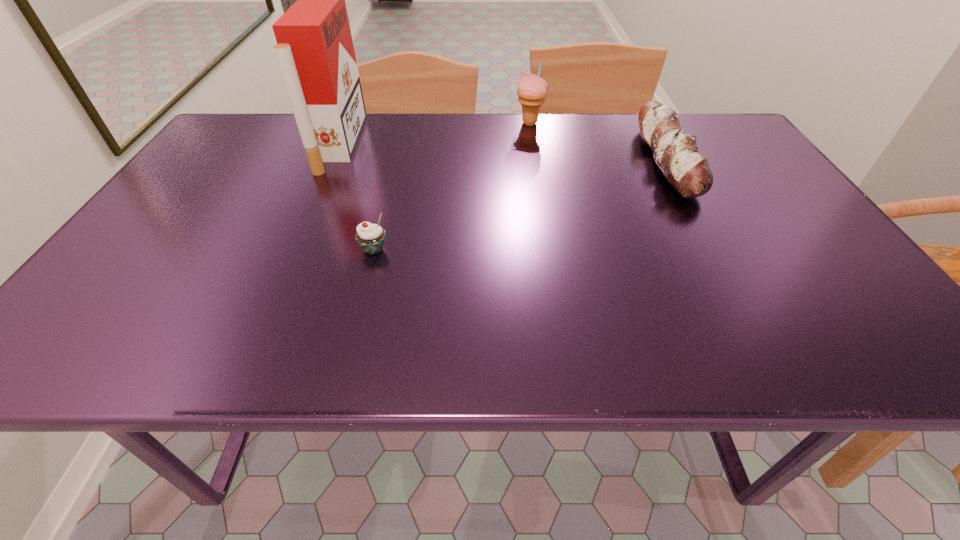
Locate an element on the screen. This screenshot has width=960, height=540. vacant area that lies between the cigarette case and the second object from left to right is located at coordinates (356, 197).

Find the location of a particular element. free space between the baguet and the leftmost object is located at coordinates (503, 152).

Identify the location of unoccupied position between the third shortest object and the rightmost object. (598, 142).

Find the location of a particular element. The image size is (960, 540). vacant space that is in between the cigarette case and the rightmost object is located at coordinates (503, 152).

Find the location of a particular element. vacant space that is in between the baguet and the cigarette case is located at coordinates (503, 152).

Find the location of a particular element. The width and height of the screenshot is (960, 540). vacant point located between the third shortest object and the cigarette case is located at coordinates (435, 134).

Identify the location of free area in between the rightmost object and the second object from left to right. (520, 205).

The width and height of the screenshot is (960, 540). I want to click on vacant space that is in between the baguet and the third object from left to right, so click(x=598, y=142).

At what (x,y) coordinates should I click in order to perform the action: click on blank region between the baguet and the icecream. Please return your answer as a coordinate pair (x, y). The image size is (960, 540). Looking at the image, I should click on [x=598, y=142].

Identify which object is located as the third nearest to the nearest object. Please provide its 2D coordinates. Your answer should be formatted as a tuple, i.e. [(x, y)], where the tuple contains the x and y coordinates of a point satisfying the conditions above.

[(676, 153)]